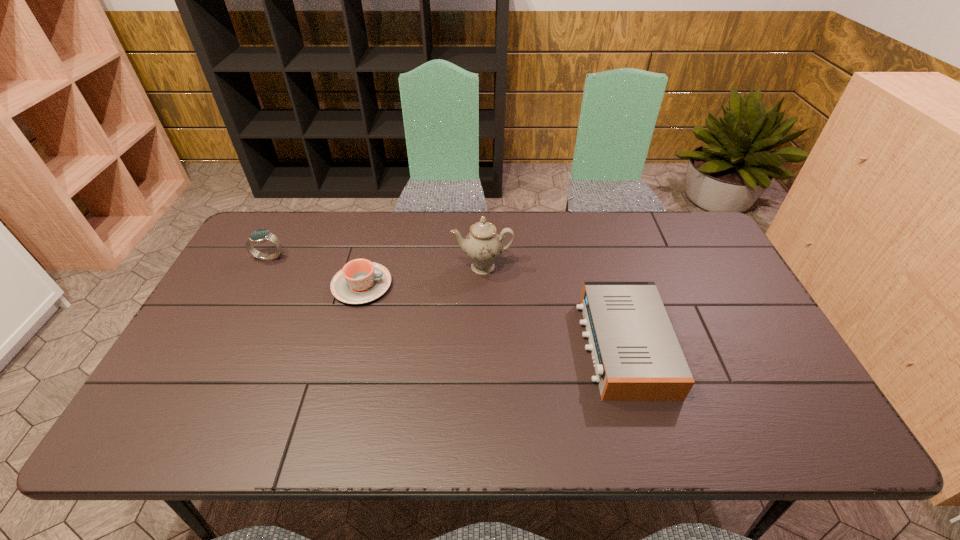
Image resolution: width=960 pixels, height=540 pixels. I want to click on free region located 0.240m on the control panel of the radio receiver, so click(492, 346).

Locate an element on the screen. This screenshot has width=960, height=540. free location located on the control panel of the radio receiver is located at coordinates (492, 346).

Locate an element on the screen. free space located 0.210m on the handle side of the shortest object is located at coordinates (463, 286).

The width and height of the screenshot is (960, 540). I want to click on chinaware positioned at the far edge, so click(483, 245).

Find the location of a particular element. The width and height of the screenshot is (960, 540). watch at the far edge is located at coordinates (259, 236).

The height and width of the screenshot is (540, 960). Identify the location of object at the left edge. (259, 236).

At what (x,y) coordinates should I click in order to perform the action: click on object that is positioned at the far left corner. Please return your answer as a coordinate pair (x, y). The width and height of the screenshot is (960, 540). Looking at the image, I should click on [x=259, y=236].

I want to click on vacant space at the far edge, so click(x=646, y=231).

The image size is (960, 540). I want to click on free location at the near edge of the desktop, so click(x=673, y=437).

The height and width of the screenshot is (540, 960). What are the coordinates of `vacant area at the left edge` in the screenshot? It's located at (253, 290).